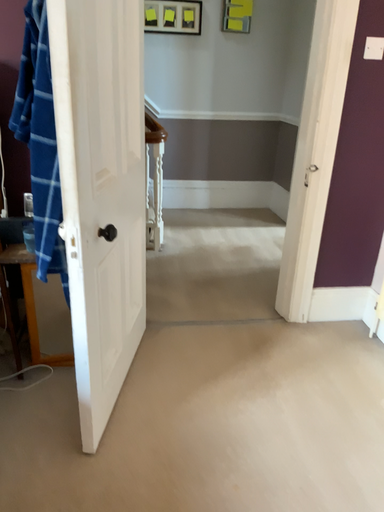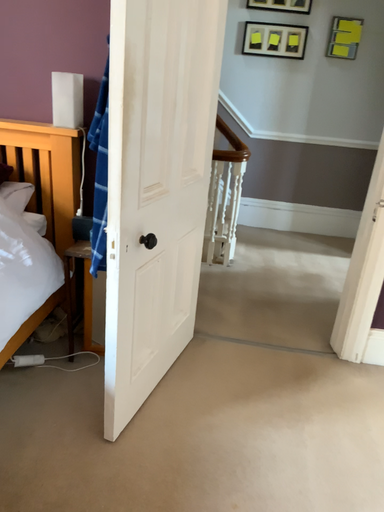
Question: Which way did the camera rotate in the video?

Choices:
 (A) rotated left
 (B) rotated right

Answer: (A)